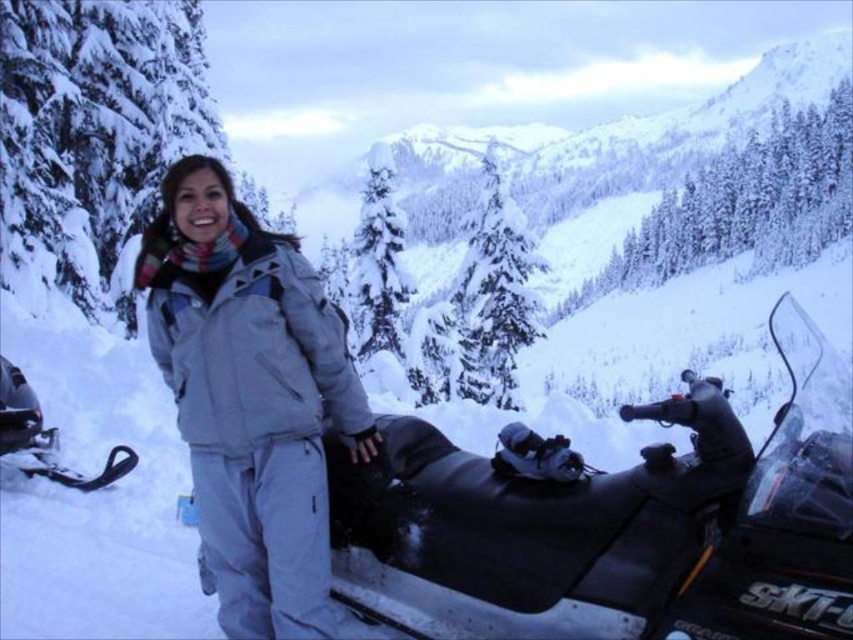
Question: Can you confirm if black rubber snowmobile at center is positioned above light gray snowsuit at center?

Choices:
 (A) no
 (B) yes

Answer: (A)

Question: Is black rubber snowmobile at center to the left of light gray snowsuit at center from the viewer's perspective?

Choices:
 (A) no
 (B) yes

Answer: (A)

Question: Does black rubber snowmobile at center have a smaller size compared to light gray snowsuit at center?

Choices:
 (A) no
 (B) yes

Answer: (A)

Question: Which point is closer to the camera taking this photo?

Choices:
 (A) (229, 568)
 (B) (654, 586)

Answer: (B)

Question: Which point is farther to the camera?

Choices:
 (A) black rubber snowmobile at center
 (B) light gray snowsuit at center

Answer: (B)